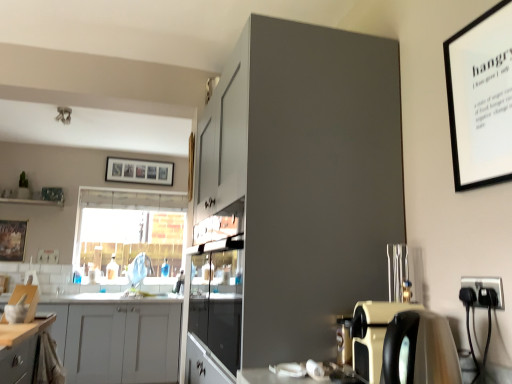
Question: Considering the relative positions of white matte cabinet at lower left, the second cabinetry viewed from the top, and matte gray cabinet at upper center, the second cabinetry positioned from the bottom, in the image provided, is white matte cabinet at lower left, the second cabinetry viewed from the top, to the left or to the right of matte gray cabinet at upper center, the second cabinetry positioned from the bottom,?

Choices:
 (A) right
 (B) left

Answer: (B)

Question: Considering the positions of point (106, 319) and point (311, 104), is point (106, 319) closer or farther from the camera than point (311, 104)?

Choices:
 (A) closer
 (B) farther

Answer: (B)

Question: Estimate the real-world distances between objects in this image. Which object is closer to the clear glass window at center?

Choices:
 (A) white matte cabinet at lower left, the 1th cabinetry when ordered from back to front
 (B) black plastic electrical outlet at lower right
 (C) matte black coffee machine at lower right
 (D) matte gray cabinet at upper center, which appears as the 1th cabinetry when viewed from the front
 (E) translucent glass bottle at center

Answer: (E)

Question: Estimate the real-world distances between objects in this image. Which object is farther from the wooden framed artwork at left, the 2th picture frame in the top-to-bottom sequence?

Choices:
 (A) white matte cabinet at lower left, marked as the first cabinetry in a bottom-to-top arrangement
 (B) clear glass window at center
 (C) wooden photo frame at upper center, placed as the first picture frame when sorted from right to left
 (D) black plastic electrical outlet at lower right
 (E) transparent glass cabinet at center

Answer: (D)